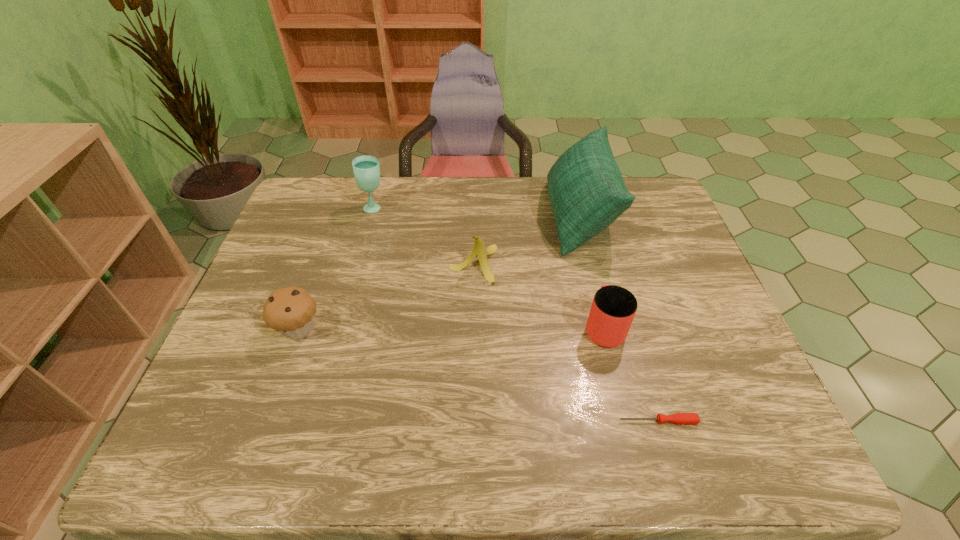
I want to click on cushion at the far edge, so click(x=586, y=190).

The height and width of the screenshot is (540, 960). What are the coordinates of `glass at the far edge` in the screenshot? It's located at (366, 169).

The width and height of the screenshot is (960, 540). Identify the location of object present at the near edge. (679, 418).

Where is `object that is positioned at the left edge`? This screenshot has width=960, height=540. object that is positioned at the left edge is located at coordinates (290, 311).

The image size is (960, 540). Find the location of `object that is at the right edge`. object that is at the right edge is located at coordinates pyautogui.click(x=679, y=418).

Identify the location of object situated at the near right corner. This screenshot has width=960, height=540. (679, 418).

Where is `vacant space at the far edge of the desktop`? The width and height of the screenshot is (960, 540). vacant space at the far edge of the desktop is located at coordinates (443, 179).

The image size is (960, 540). Identify the location of free region at the near edge of the desktop. (465, 435).

This screenshot has height=540, width=960. In the image, there is a desktop. Find the location of `vacant area at the left edge`. vacant area at the left edge is located at coordinates (277, 288).

I want to click on vacant area at the right edge of the desktop, so click(667, 223).